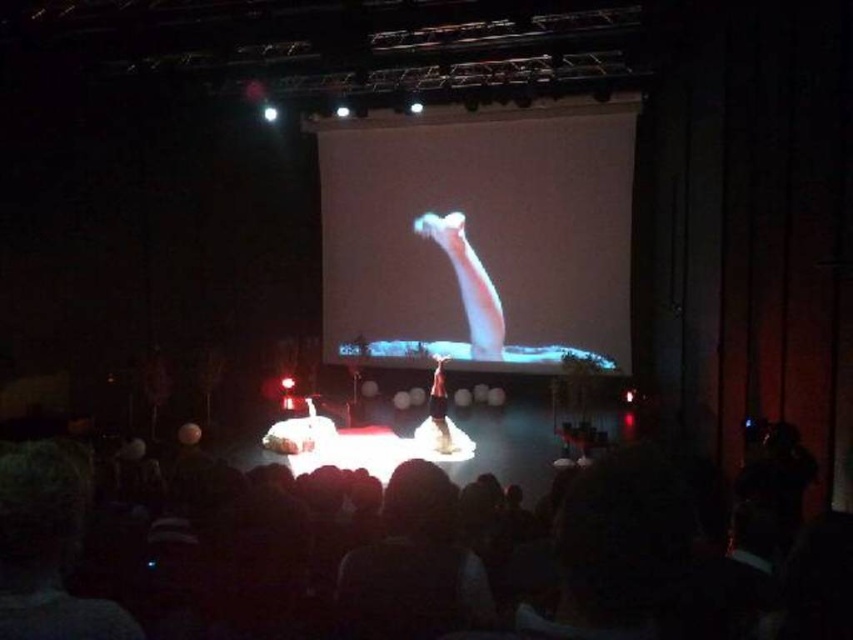
Question: Which point is farther to the camera?

Choices:
 (A) (395, 614)
 (B) (585, 540)
 (C) (430, 413)

Answer: (C)

Question: Based on their relative distances, which object is nearer to the black hair at center?

Choices:
 (A) white matte projection screen at center
 (B) translucent white figure at center

Answer: (B)

Question: Can you confirm if translucent white figure at center is wider than white fabric at center?

Choices:
 (A) no
 (B) yes

Answer: (B)

Question: Can you confirm if translucent white figure at center is thinner than white fabric at center?

Choices:
 (A) no
 (B) yes

Answer: (A)

Question: Among these points, which one is farthest from the camera?

Choices:
 (A) (392, 632)
 (B) (445, 236)
 (C) (445, 404)

Answer: (B)

Question: Is black fabric crowd at lower center positioned in front of white matte projection screen at center?

Choices:
 (A) yes
 (B) no

Answer: (A)